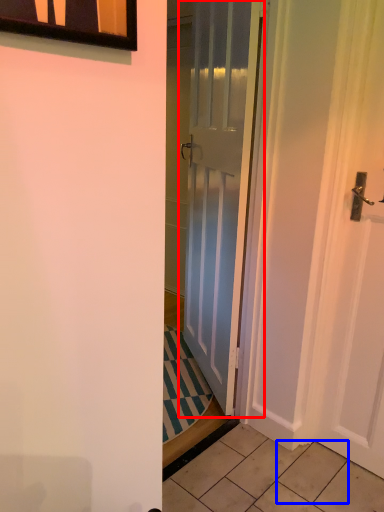
Question: Which object appears farthest to the camera in this image, door (highlighted by a red box) or tile (highlighted by a blue box)?

Choices:
 (A) door
 (B) tile

Answer: (B)